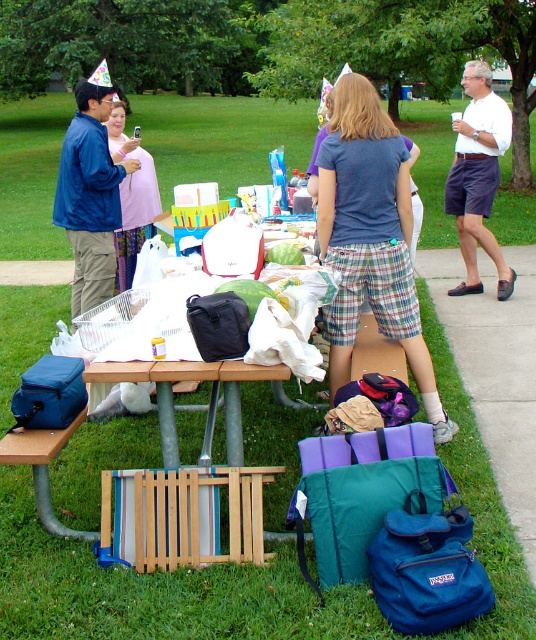
Is blue matte jacket at upper left above white cotton shirt at upper right?

Incorrect, blue matte jacket at upper left is not positioned above white cotton shirt at upper right.

Is point (86, 84) positioned in front of point (477, 204)?

Yes, it is in front of point (477, 204).

Identify the location of blue matte jacket at upper left. (91, 193).

Can you confirm if white cotton shirt at upper right is positioned to the left of pink fabric dress at left?

In fact, white cotton shirt at upper right is to the right of pink fabric dress at left.

Can you confirm if white cotton shirt at upper right is positioned above pink fabric dress at left?

No, white cotton shirt at upper right is not above pink fabric dress at left.

Is point (472, 148) less distant than point (129, 262)?

No.

I want to click on white cotton shirt at upper right, so [478, 177].

Image resolution: width=536 pixels, height=640 pixels. I want to click on blue matte jacket at upper left, so click(91, 193).

Does point (61, 221) lie in front of point (137, 179)?

Yes, point (61, 221) is closer to viewer.

The width and height of the screenshot is (536, 640). What are the coordinates of `blue matte jacket at upper left` in the screenshot? It's located at (91, 193).